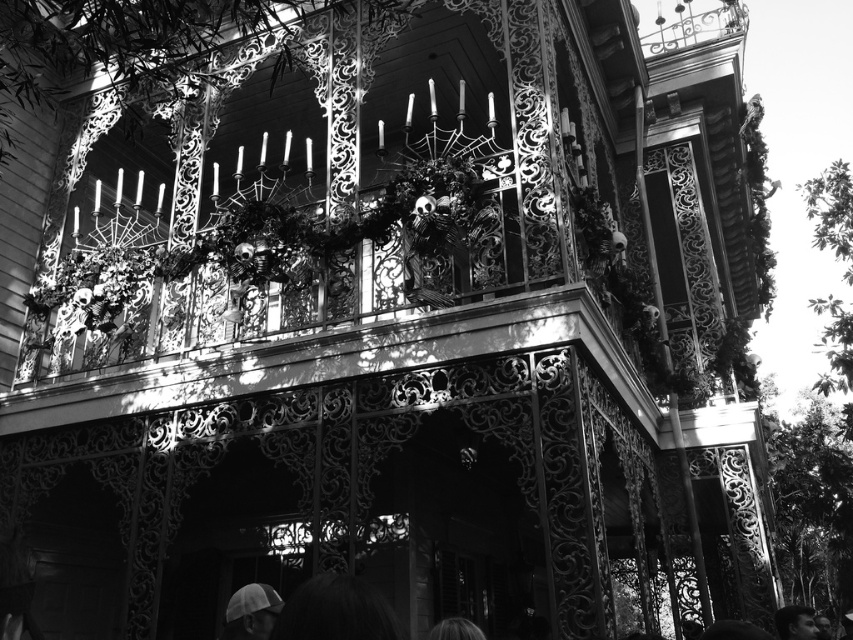
Question: Is matte white cap at lower left behind blonde hair at lower center?

Choices:
 (A) no
 (B) yes

Answer: (B)

Question: Which point is closer to the camera?

Choices:
 (A) blonde hair at lower center
 (B) smooth skin face at lower center
 (C) matte white cap at lower left

Answer: (A)

Question: Can you confirm if matte white cap at lower left is bigger than smooth skin face at lower center?

Choices:
 (A) yes
 (B) no

Answer: (B)

Question: In this image, where is matte white cap at lower left located relative to blonde hair at lower center?

Choices:
 (A) above
 (B) below

Answer: (B)

Question: Which of the following is the farthest from the observer?

Choices:
 (A) (451, 634)
 (B) (809, 618)

Answer: (B)

Question: Which of the following is the farthest from the observer?

Choices:
 (A) (790, 634)
 (B) (476, 634)

Answer: (A)